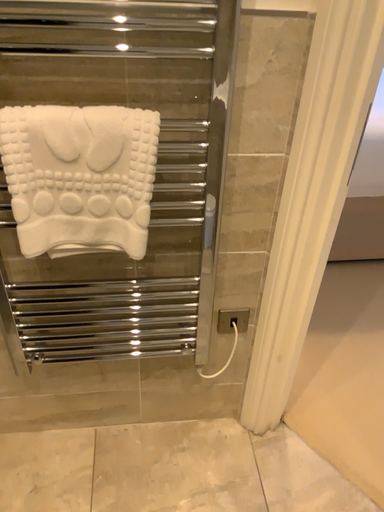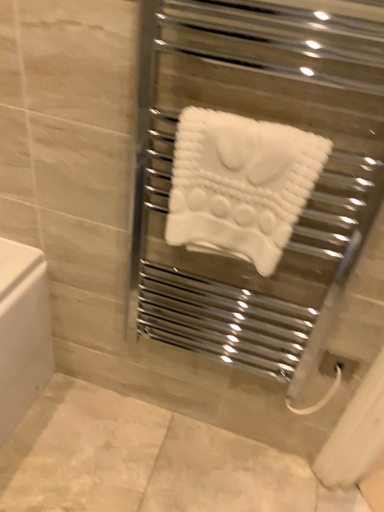
Question: Which way did the camera rotate in the video?

Choices:
 (A) rotated left
 (B) rotated right

Answer: (A)